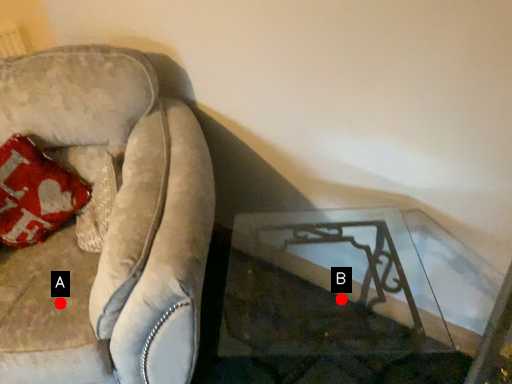
Question: Two points are circled on the image, labeled by A and B beside each circle. Which point is closer to the camera?

Choices:
 (A) A is closer
 (B) B is closer

Answer: (A)